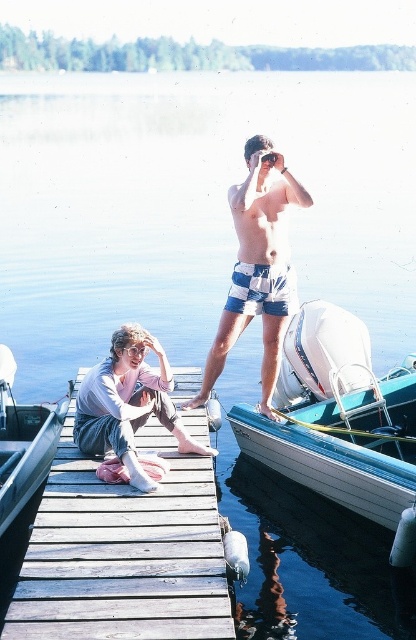
Which is more to the right, wooden at center or denim pants at center?

denim pants at center is more to the right.

Between wooden at center and denim pants at center, which one is positioned higher?

denim pants at center

This screenshot has width=416, height=640. What are the coordinates of `wooden at center` in the screenshot? It's located at (123, 552).

Find the location of a particular element. This screenshot has width=416, height=640. wooden at center is located at coordinates (123, 552).

Can you confirm if white glossy boat at center is bigger than clear plastic goggles at center?

Yes, white glossy boat at center is bigger than clear plastic goggles at center.

Who is taller, white glossy boat at center or clear plastic goggles at center?

white glossy boat at center

Where is `white glossy boat at center`? white glossy boat at center is located at coordinates (339, 420).

Based on the photo, does striped swim trunks at center have a smaller size compared to clear plastic goggles at center?

Actually, striped swim trunks at center might be larger than clear plastic goggles at center.

Can you confirm if striped swim trunks at center is positioned below clear plastic goggles at center?

Actually, striped swim trunks at center is above clear plastic goggles at center.

Between point (247, 228) and point (140, 353), which one is positioned in front?

Point (140, 353)

Where is `striped swim trunks at center`? Image resolution: width=416 pixels, height=640 pixels. striped swim trunks at center is located at coordinates (x=257, y=266).